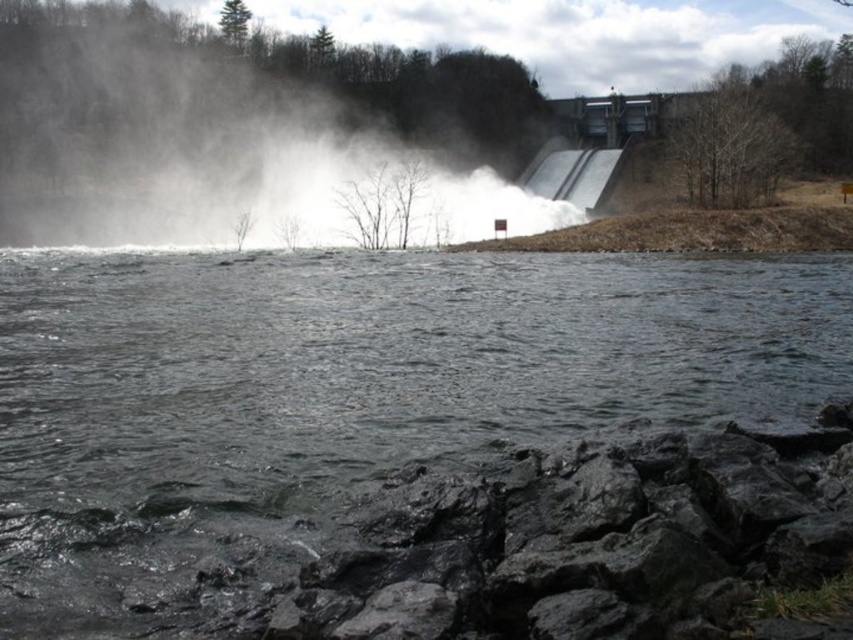
Does point (477, 566) come in front of point (604, 170)?

Yes.

Is point (827, 506) less distant than point (548, 145)?

That is True.

This screenshot has height=640, width=853. In order to click on dark gray rock at lower center in this screenshot , I will do `click(589, 541)`.

Who is more forward, (102, 387) or (605, 172)?

Positioned in front is point (102, 387).

Who is taller, dark gray stone at lower center or gray metallic dam at upper right?

gray metallic dam at upper right is taller.

Who is more distant from viewer, (x=245, y=369) or (x=567, y=160)?

Positioned behind is point (x=567, y=160).

Where is `dark gray stone at lower center`? This screenshot has width=853, height=640. dark gray stone at lower center is located at coordinates (366, 365).

How far apart are dark gray rock at lower center and white mist at upper center?

dark gray rock at lower center and white mist at upper center are 100.64 meters apart from each other.

Between dark gray rock at lower center and white mist at upper center, which one is positioned higher?

white mist at upper center

Who is more distant from viewer, (564, 538) or (61, 1)?

The point (61, 1) is more distant.

In order to click on dark gray rock at lower center in this screenshot , I will do `click(589, 541)`.